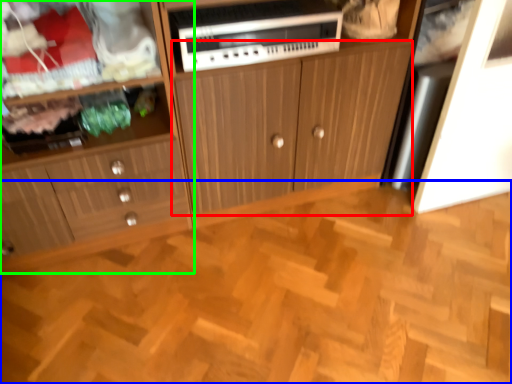
Question: Which object is positioned farthest from cabinetry (highlighted by a red box)? Select from hardwood (highlighted by a blue box) and cabinetry (highlighted by a green box).

Choices:
 (A) hardwood
 (B) cabinetry

Answer: (A)